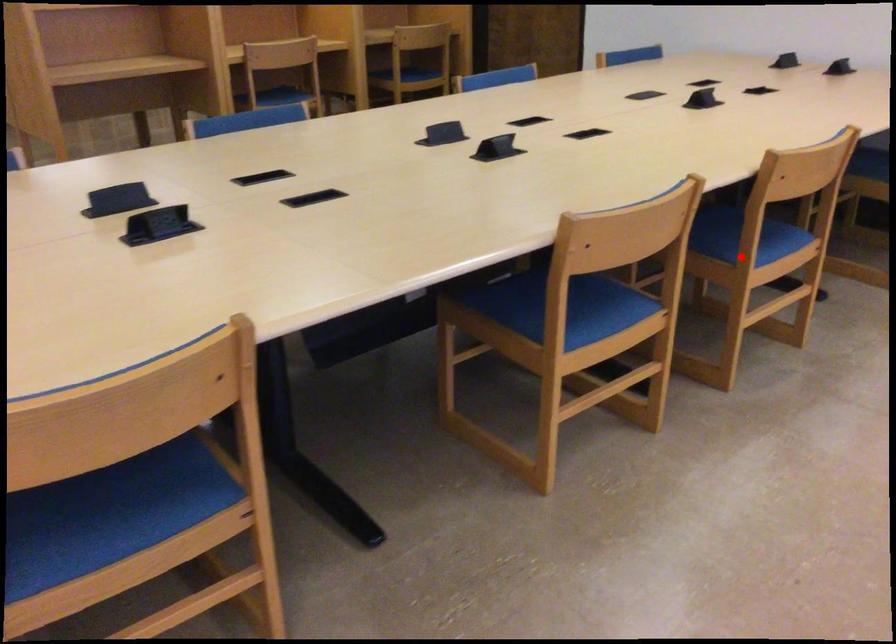
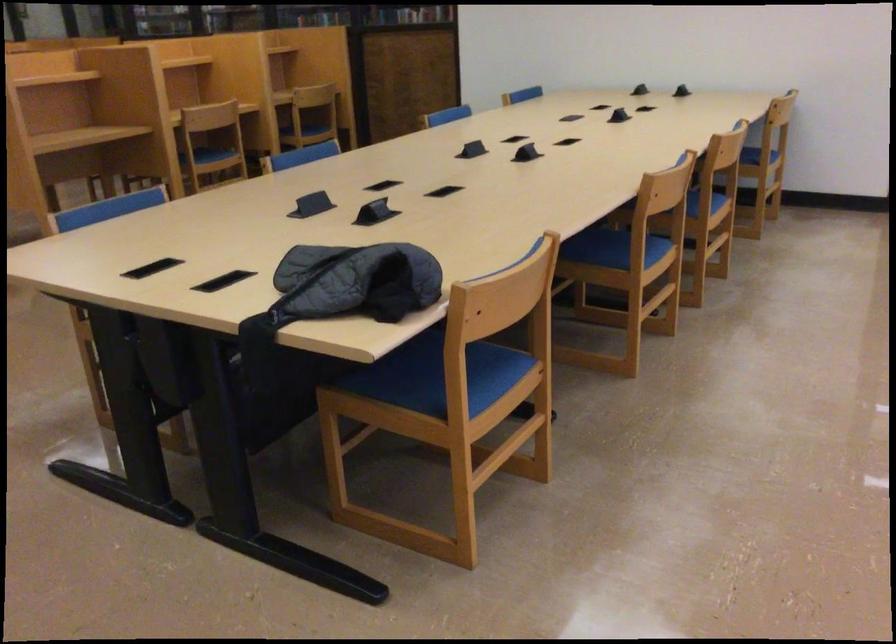
Find the pixel in the second image that matches the highlighted location in the first image.

(702, 207)